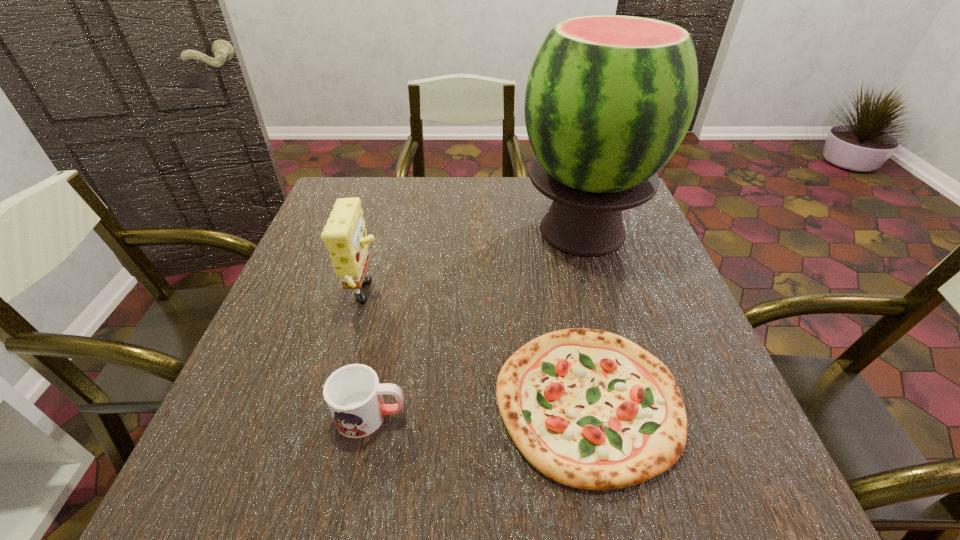
Locate an element on the screen. This screenshot has width=960, height=540. watermelon is located at coordinates (609, 98).

You are a GUI agent. You are given a task and a screenshot of the screen. Output one action in this format:
    pyautogui.click(x=<x>, y=<y>)
    Task: Click on the sponge
    
    Given the screenshot: What is the action you would take?
    pyautogui.click(x=344, y=235)

Locate an element on the screen. This screenshot has width=960, height=540. the second shortest object is located at coordinates (354, 396).

At what (x,y) coordinates should I click in order to perform the action: click on pizza. Please return your answer as a coordinate pair (x, y). The image size is (960, 540). Looking at the image, I should click on (590, 409).

The height and width of the screenshot is (540, 960). I want to click on vacant space located on the front of the tallest object, so click(x=620, y=357).

The image size is (960, 540). Find the location of `free space located 0.380m on the face of the third shortest object`. free space located 0.380m on the face of the third shortest object is located at coordinates (557, 298).

Locate an element on the screen. The image size is (960, 540). vacant region located 0.250m on the side of the mug with the handle is located at coordinates (552, 415).

This screenshot has height=540, width=960. Find the location of `free space located on the right of the shortest object`. free space located on the right of the shortest object is located at coordinates (708, 401).

Locate an element on the screen. Image resolution: width=960 pixels, height=540 pixels. object that is at the far edge is located at coordinates pyautogui.click(x=609, y=98).

The width and height of the screenshot is (960, 540). I want to click on object located in the near edge section of the desktop, so click(x=590, y=409).